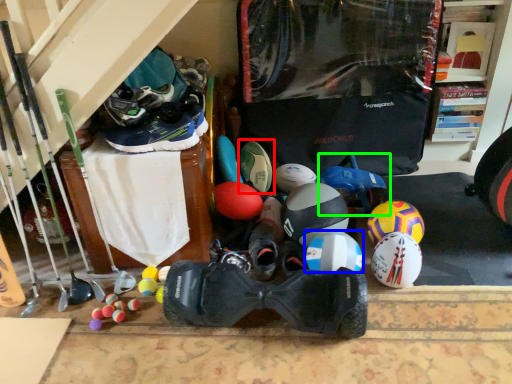
Question: Based on their relative distances, which object is farther from footwear (highlighted by a red box)? Choose from helmet (highlighted by a blue box) and toy (highlighted by a green box).

Choices:
 (A) helmet
 (B) toy

Answer: (A)